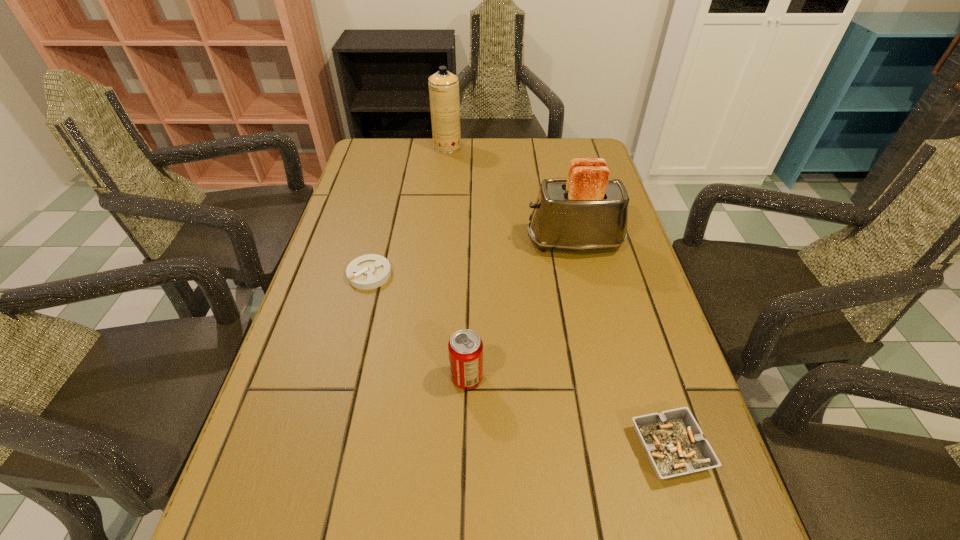
Locate an element on the screen. aerosol can is located at coordinates (443, 86).

Find the location of `the fourth object from right to left`. the fourth object from right to left is located at coordinates (443, 86).

The width and height of the screenshot is (960, 540). Identify the location of toaster. (587, 211).

Find the location of a particular element. The width and height of the screenshot is (960, 540). the second nearest object is located at coordinates (465, 347).

Identify the location of the third object from left to right. (465, 347).

You are a GUI agent. You are given a task and a screenshot of the screen. Output one action in this format:
    pyautogui.click(x=<x>, y=<y>)
    Task: Click on the nearer ashtray
    
    Given the screenshot: What is the action you would take?
    pyautogui.click(x=673, y=441)

The height and width of the screenshot is (540, 960). What are the coordinates of `the nearest object` in the screenshot? It's located at (673, 441).

At what (x,y) coordinates should I click in order to perform the action: click on the farther ashtray. Please return your answer as a coordinate pair (x, y). The width and height of the screenshot is (960, 540). Looking at the image, I should click on (370, 271).

Locate an element on the screen. The image size is (960, 540). the leftmost object is located at coordinates (370, 271).

The width and height of the screenshot is (960, 540). I want to click on free region located on the front of the second object from left to right, so click(x=445, y=161).